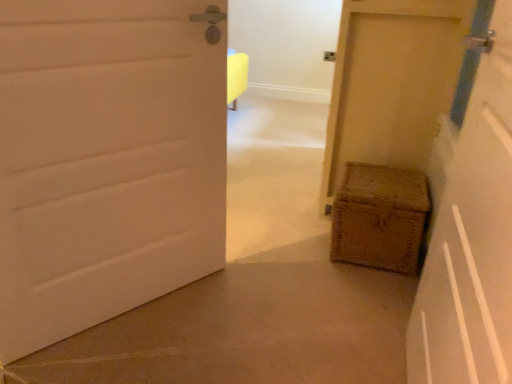
Question: From the image's perspective, is matte yellow door at right, arranged as the 2th door when viewed from the left, above or below woven wood chest at lower right, acting as the third door starting from the left?

Choices:
 (A) above
 (B) below

Answer: (B)

Question: In terms of width, does matte yellow door at right, arranged as the 2th door when viewed from the left, look wider or thinner when compared to woven wood chest at lower right, acting as the third door starting from the left?

Choices:
 (A) wide
 (B) thin

Answer: (B)

Question: Estimate the real-world distances between objects in this image. Which object is closer to the woven brown basket at lower right?

Choices:
 (A) white matte door at left, the 1th door when ordered from left to right
 (B) woven wood chest at lower right, acting as the third door starting from the left
 (C) matte yellow door at right, which is the second door from right to left

Answer: (B)

Question: Which of these objects is positioned closest to the woven wood chest at lower right, which ranks as the 1th door in right-to-left order?

Choices:
 (A) white matte door at left, which is the 3th door from right to left
 (B) matte yellow door at right, arranged as the 2th door when viewed from the left
 (C) woven brown basket at lower right

Answer: (C)